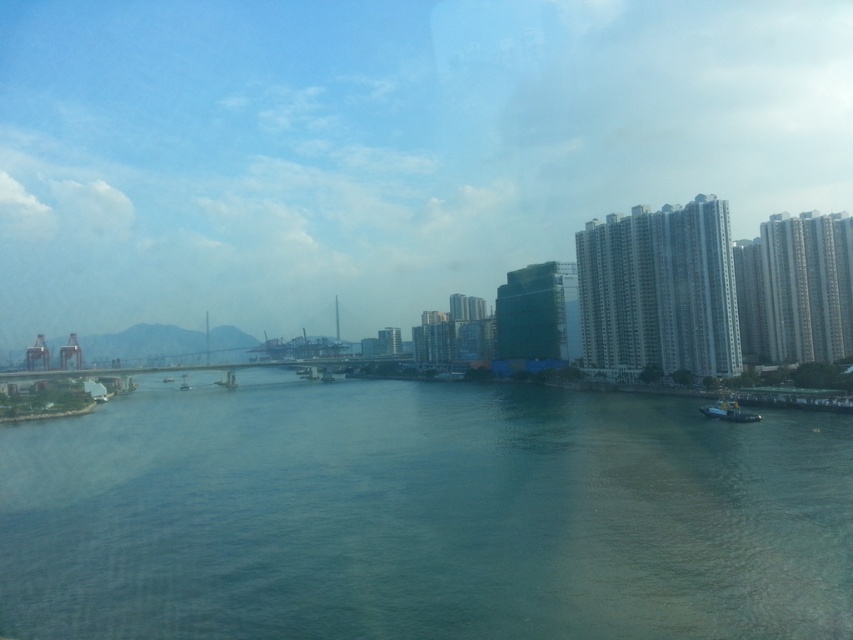
Does greenish-blue water at center appear on the right side of metallic gray boat at center?

Indeed, greenish-blue water at center is positioned on the right side of metallic gray boat at center.

In the scene shown: Who is more distant from viewer, (815, 602) or (183, 385)?

The point (183, 385) is more distant.

What are the coordinates of `greenish-blue water at center` in the screenshot? It's located at (422, 515).

Does yellow matte boat at lower right lie in front of metallic gray boat at center?

Yes.

Is yellow matte boat at lower right wider than metallic gray boat at center?

No.

Locate an element on the screen. The height and width of the screenshot is (640, 853). yellow matte boat at lower right is located at coordinates (728, 410).

Is greenish-blue water at center to the left of yellow matte boat at lower right from the viewer's perspective?

Indeed, greenish-blue water at center is positioned on the left side of yellow matte boat at lower right.

Is point (598, 588) farther from viewer compared to point (730, 417)?

That is False.

At what (x,y) coordinates should I click in order to perform the action: click on greenish-blue water at center. Please return your answer as a coordinate pair (x, y). Looking at the image, I should click on (422, 515).